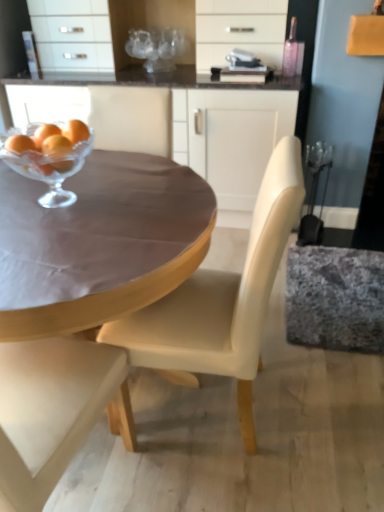
Image resolution: width=384 pixels, height=512 pixels. In order to click on vacant area on top of matte brown table at center (from a real-world perspective) in this screenshot , I will do [95, 200].